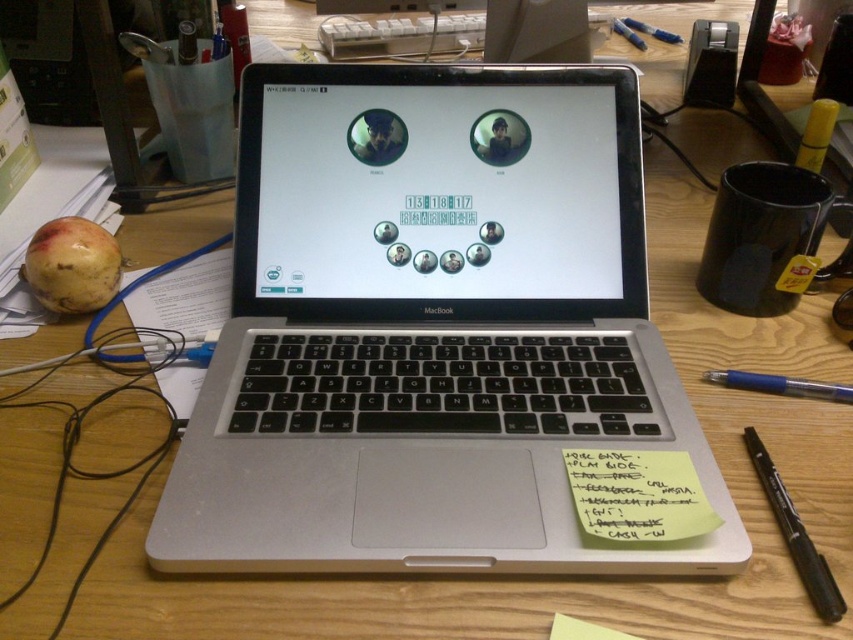
You are organizing items on your desk and need to place the black plastic pen at lower right closer to the edge. However, there is a ripe yellow apple at left in the way. Can you move the pen without moving the apple?

The black plastic pen at lower right is behind the ripe yellow apple at left, so you can move it without disturbing the apple by moving it around the sides or front of the apple.

From the picture: You are a photographer taking a picture of the MacBook laptop on the wooden desk. The ripe yellow apple at left is partially visible in the corner of the frame. To ensure the apple is fully in the photo, where should you adjust the camera? Specify the direction based on the coordinates provided in the scene description.

The ripe yellow apple at left is located at coordinates point (73, 266). To fully include it in the photo, adjust the camera slightly to the left and downward since the apple is positioned towards the lower left corner of the desk.

You are organizing your desk and want to place a new item between the silver metallic laptop at center and the yellow paper at lower right. Is there space between them for a small notebook?

The silver metallic laptop at center is in front of the yellow paper at lower right, meaning they are aligned along the depth axis. Since the laptop is in front, there isn